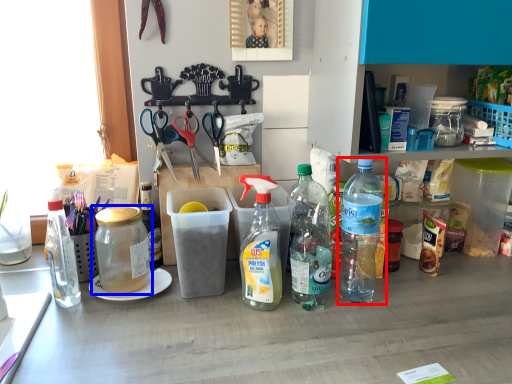
Question: Which object is closer to the camera taking this photo, bottle (highlighted by a red box) or bottle (highlighted by a blue box)?

Choices:
 (A) bottle
 (B) bottle

Answer: (A)